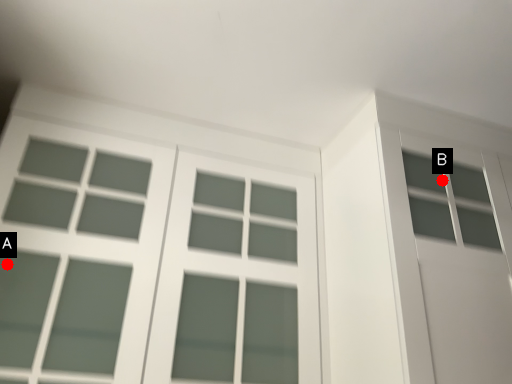
Question: Two points are circled on the image, labeled by A and B beside each circle. Which point is farther to the camera?

Choices:
 (A) A is further
 (B) B is further

Answer: (B)